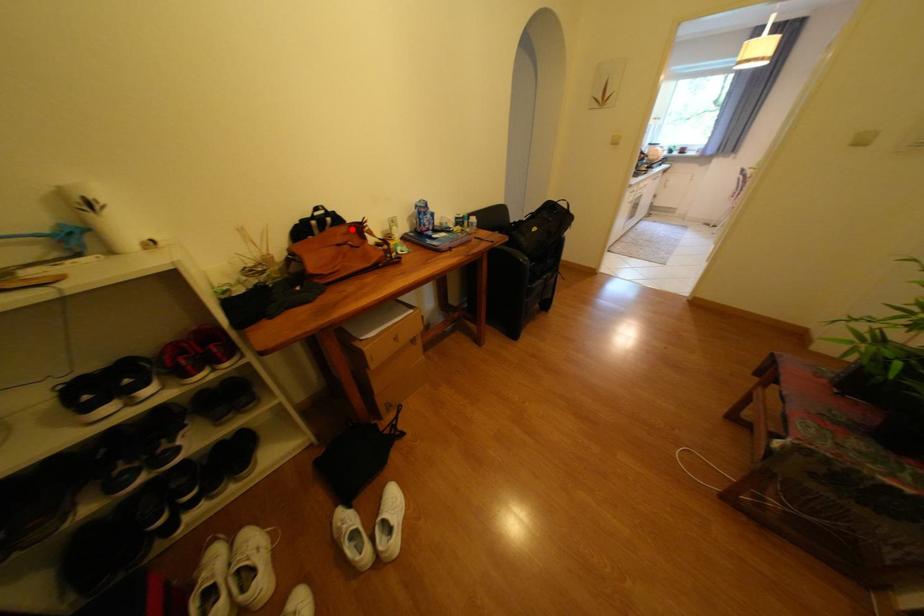
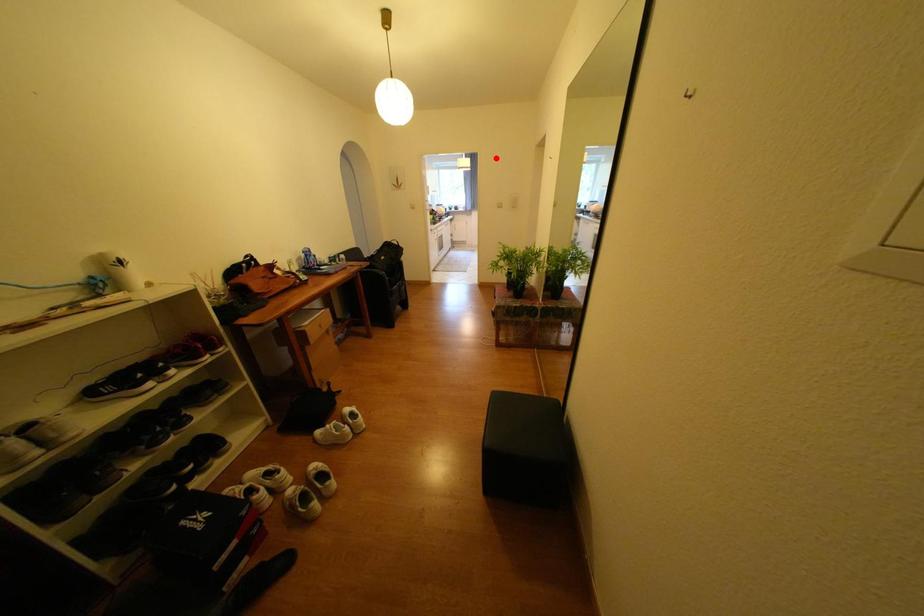
I am providing you with two images of the same scene from different viewpoints. A red point is marked on the first image and another point is marked on the second image. Is the marked point in image1 the same physical position as the marked point in image2?

No